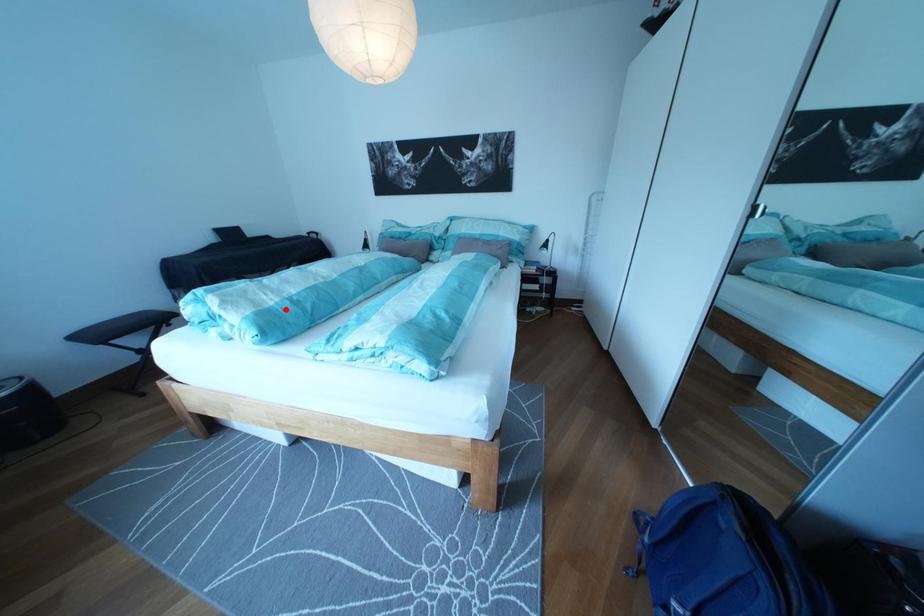
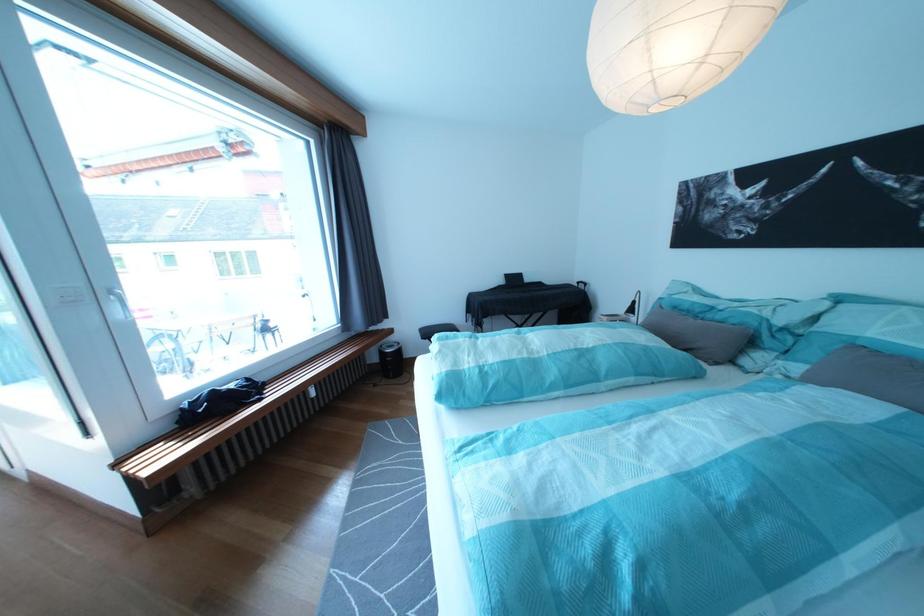
Question: I am providing you with two images of the same scene from different viewpoints. Image1 has a red point marked. In image2, the corresponding 3D location appears at what relative position? Reply with the corresponding letter.

Choices:
 (A) Closer
 (B) Farther

Answer: (B)